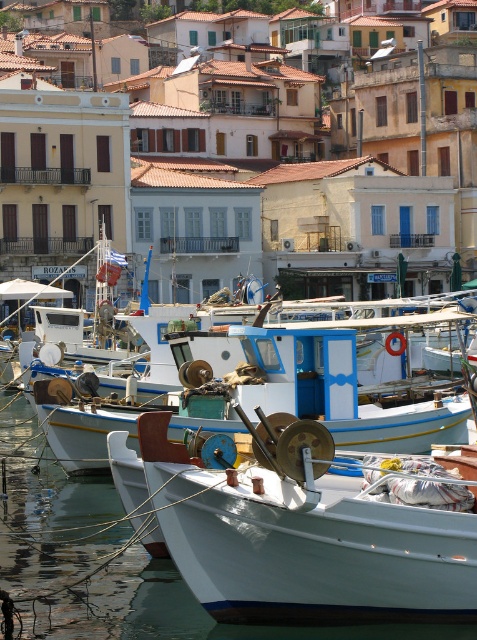
Between white matte boat at center and white painted wood boat at center, which one has more height?

white painted wood boat at center is taller.

Is white matte boat at center shorter than white painted wood boat at center?

Yes.

Is point (315, 602) farther from viewer compared to point (269, 328)?

No.

Find the location of `white matte boat at center`. white matte boat at center is located at coordinates (303, 538).